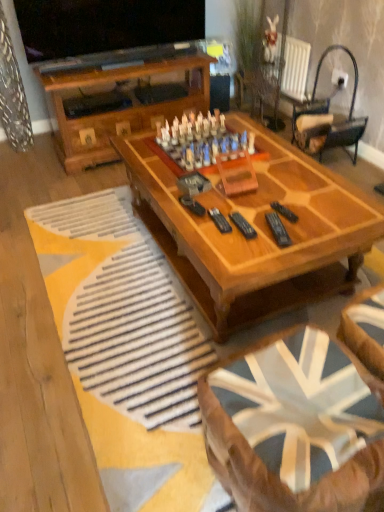
Locate an element on the screen. The image size is (384, 512). free space between black plastic remote at center, positioned as the first remote in right-to-left order, and black plastic remote at center, marked as the 1th remote in a left-to-right arrangement is located at coordinates (258, 219).